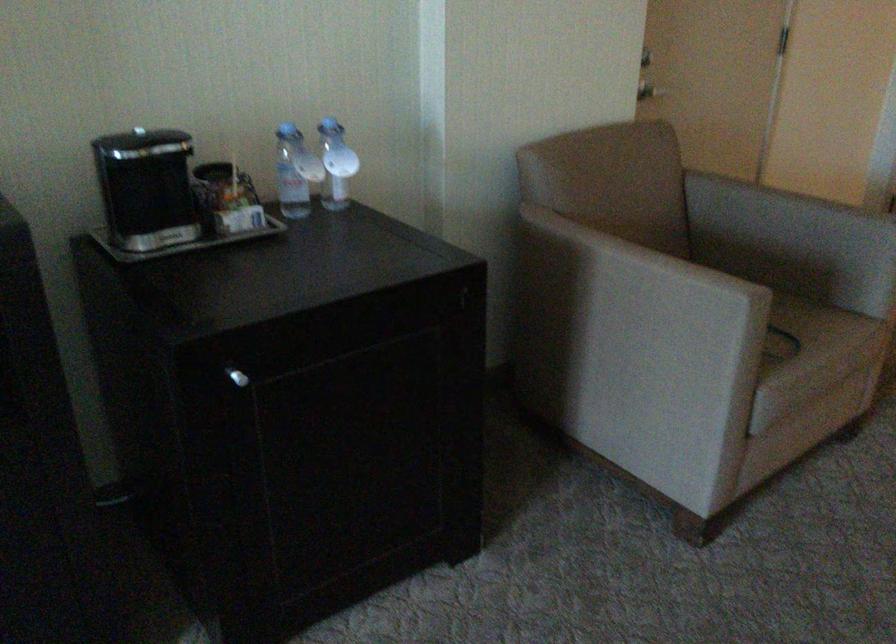
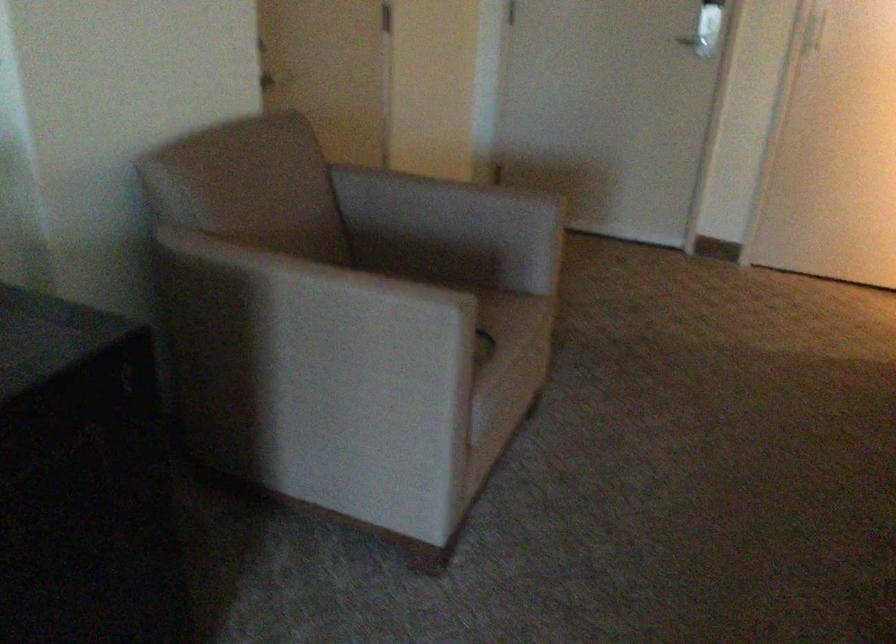
Find the pixel in the second image that matches the point at 622,292 in the first image.

(314, 325)